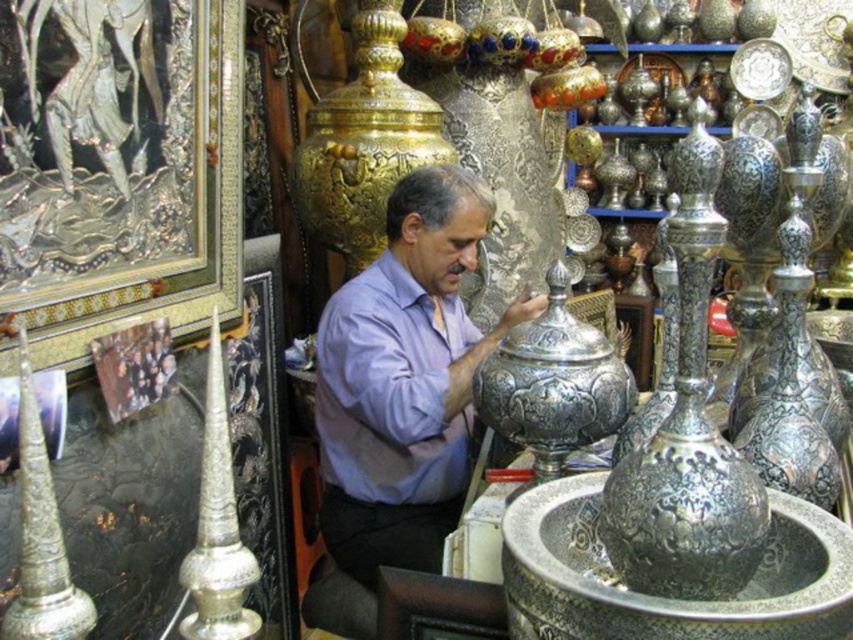
Question: Which point is farther to the camera?

Choices:
 (A) polished silver vase at center-right
 (B) purple matte dress shirt at center
 (C) purple matte shirt at center

Answer: (C)

Question: Can you confirm if purple matte shirt at center is positioned to the right of purple matte dress shirt at center?

Choices:
 (A) no
 (B) yes

Answer: (B)

Question: Can you confirm if polished silver vase at center-right is bigger than purple matte dress shirt at center?

Choices:
 (A) no
 (B) yes

Answer: (A)

Question: Which object is closer to the camera taking this photo?

Choices:
 (A) purple matte shirt at center
 (B) polished silver vase at center-right
 (C) purple matte dress shirt at center

Answer: (B)

Question: Can you confirm if purple matte shirt at center is positioned above purple matte dress shirt at center?

Choices:
 (A) no
 (B) yes

Answer: (B)

Question: Which point appears farthest from the camera in this image?

Choices:
 (A) (413, 552)
 (B) (740, 512)
 (C) (370, 468)

Answer: (C)